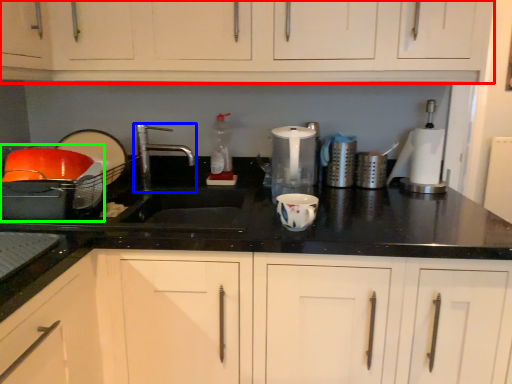
Question: Estimate the real-world distances between objects in this image. Which object is farther from cabinetry (highlighted by a red box), tap (highlighted by a blue box) or appliance (highlighted by a green box)?

Choices:
 (A) tap
 (B) appliance

Answer: (A)